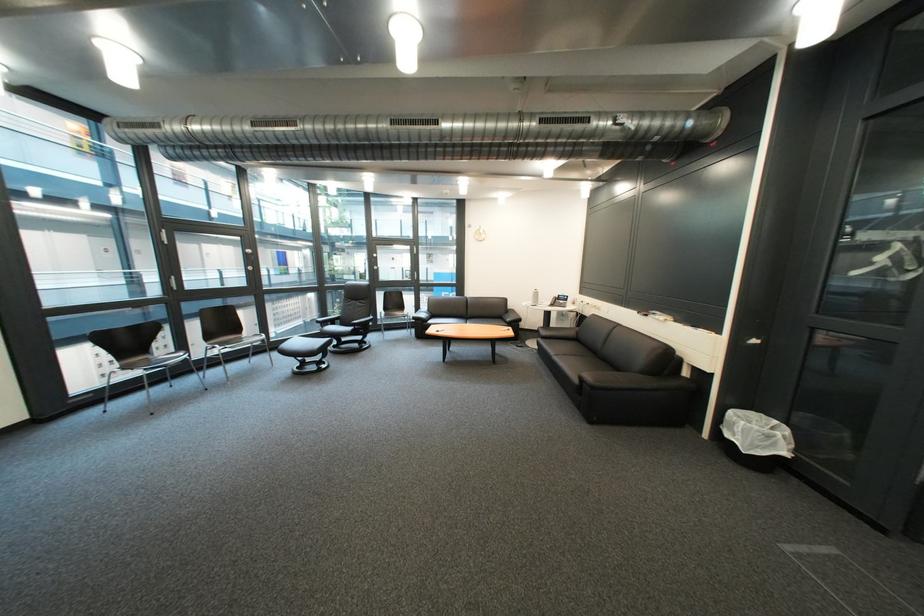
The image size is (924, 616). In order to click on lounge chair sitting surface in this screenshot , I will do `click(569, 347)`.